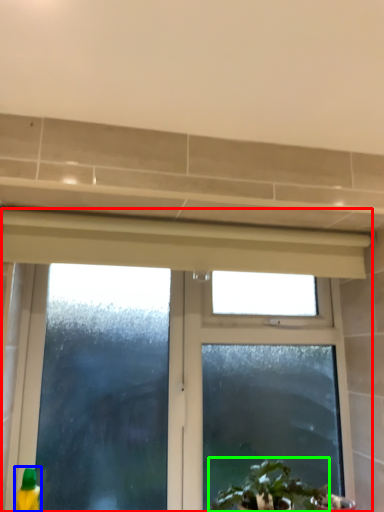
Question: Which is nearer to the window (highlighted by a red box)? cleaning product (highlighted by a blue box) or houseplant (highlighted by a green box).

Choices:
 (A) cleaning product
 (B) houseplant

Answer: (B)